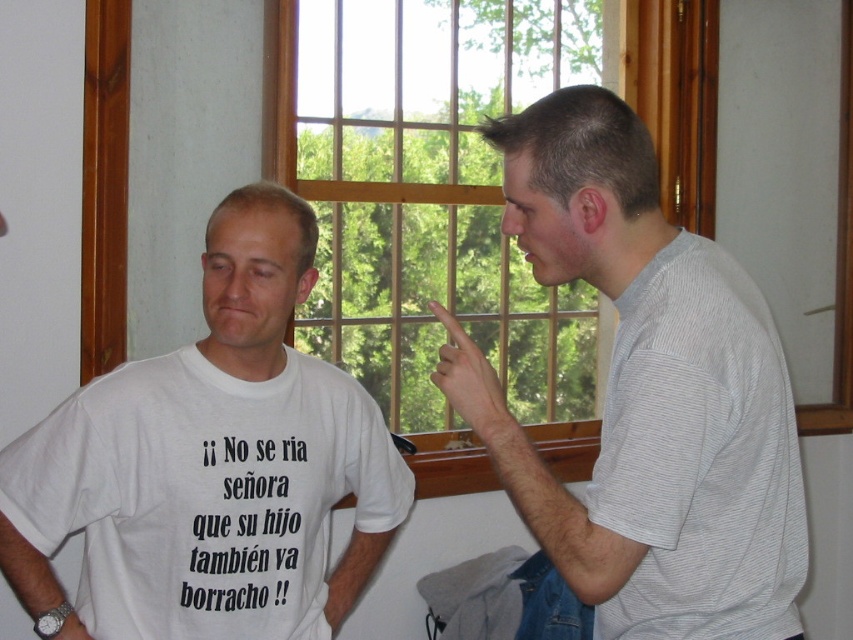
You are standing in the room and want to move from the point at coordinates point (569, 49) to the point at coordinates point (699, 499). Can you walk directly between them without any obstacles?

Point (569, 49) is behind point (699, 499), so you cannot walk directly between them without obstacles.